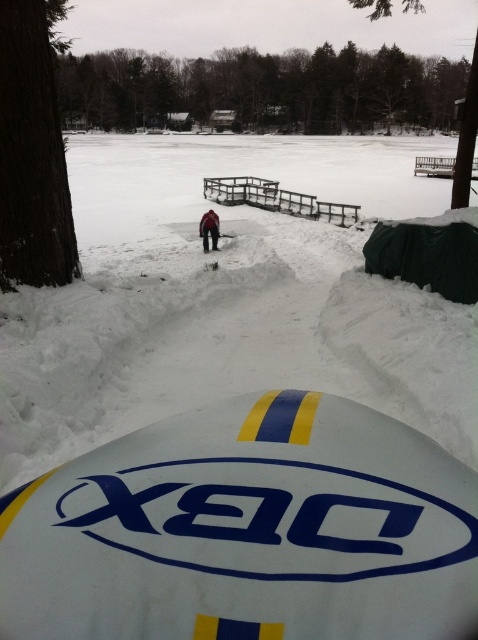
Can you confirm if white glossy surfboard at center is positioned below dark brown fur coat at center?

Correct, white glossy surfboard at center is located below dark brown fur coat at center.

Does white glossy surfboard at center have a larger size compared to dark brown fur coat at center?

Yes.

Who is more forward, (x=108, y=563) or (x=213, y=212)?

Positioned in front is point (x=108, y=563).

In order to click on white glossy surfboard at center in this screenshot , I will do `click(247, 531)`.

Does point (116, 77) lie behind point (207, 246)?

Yes, it is.

Is point (134, 67) in front of point (214, 244)?

No, it is not.

Between point (395, 92) and point (210, 220), which one is positioned in front?

Point (210, 220)

In order to click on green leafy tree at upper center in this screenshot , I will do `click(261, 88)`.

Can you confirm if dark brown wood at left is thinner than dark brown fur coat at center?

Incorrect, dark brown wood at left's width is not less than dark brown fur coat at center's.

Does point (17, 236) come closer to viewer compared to point (216, 225)?

Yes, it is in front of point (216, 225).

This screenshot has height=640, width=478. Describe the element at coordinates (32, 150) in the screenshot. I see `dark brown wood at left` at that location.

At what (x,y) coordinates should I click in order to perform the action: click on dark brown wood at left. Please return your answer as a coordinate pair (x, y). This screenshot has width=478, height=640. Looking at the image, I should click on (32, 150).